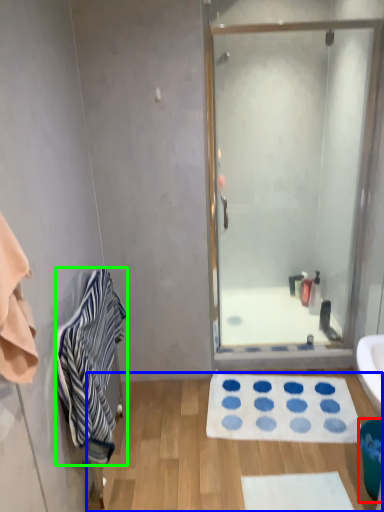
Question: Which is nearer to the trash bin/can (highlighted by a red box)? plain (highlighted by a blue box) or towel/napkin (highlighted by a green box).

Choices:
 (A) plain
 (B) towel/napkin

Answer: (A)